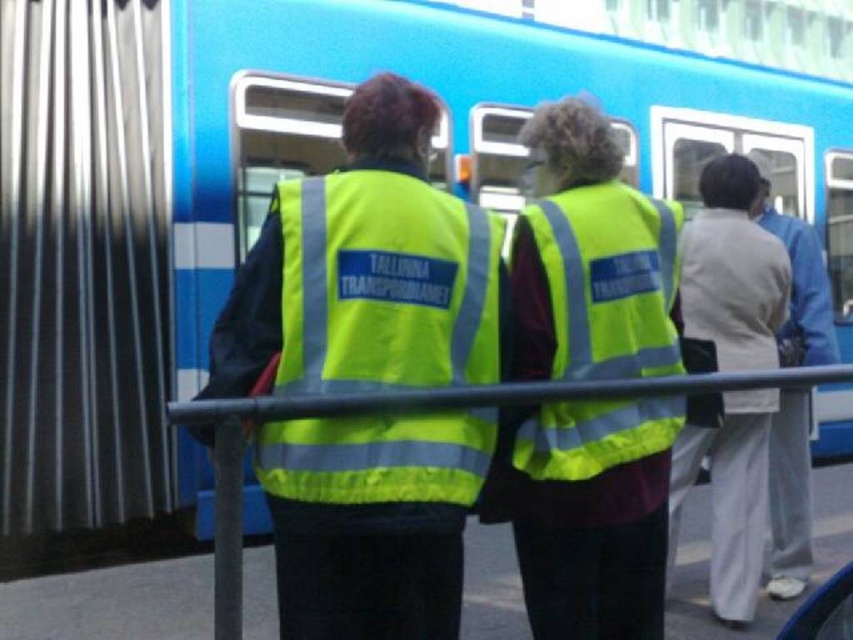
Question: Observing the image, what is the correct spatial positioning of neon yellow reflective vest at center in reference to white cotton pants at right?

Choices:
 (A) right
 (B) left

Answer: (B)

Question: Which point appears closest to the camera in this image?

Choices:
 (A) (749, 444)
 (B) (318, 413)
 (C) (636, 273)

Answer: (B)

Question: Which of the following is the closest to the observer?

Choices:
 (A) white cotton pants at right
 (B) reflective plastic rail at center

Answer: (B)

Question: Which object is positioned farthest from the white cotton pants at right?

Choices:
 (A) reflective plastic rail at center
 (B) neon yellow reflective vest at center

Answer: (B)

Question: Is neon yellow reflective vest at center positioned at the back of reflective plastic rail at center?

Choices:
 (A) no
 (B) yes

Answer: (B)

Question: From the image, what is the correct spatial relationship of neon yellow reflective vest at center in relation to white cotton pants at right?

Choices:
 (A) above
 (B) below

Answer: (A)